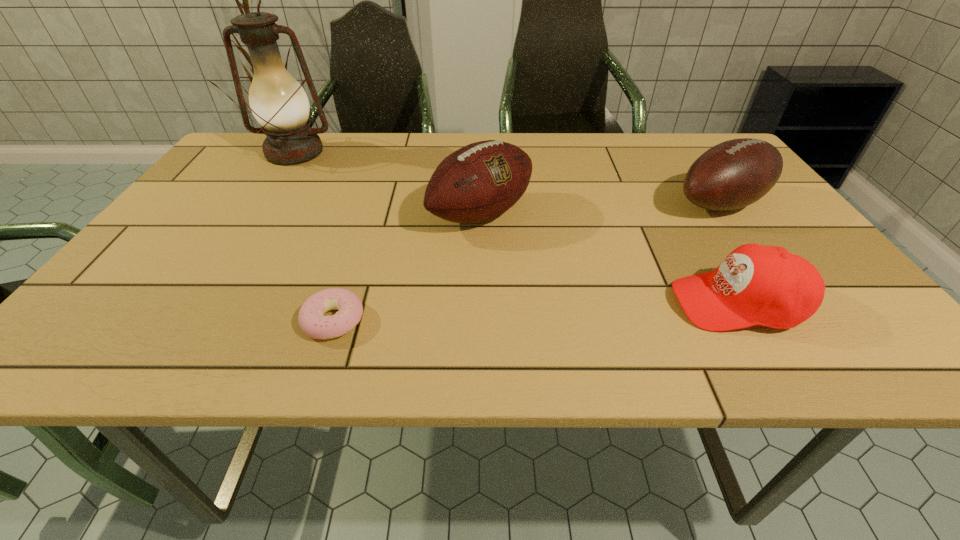
The image size is (960, 540). I want to click on object that is at the far left corner, so click(x=278, y=102).

Identify the location of object at the near right corner. The height and width of the screenshot is (540, 960). (762, 285).

Where is `free space at the far edge of the desktop`? free space at the far edge of the desktop is located at coordinates (346, 171).

Where is `free region at the left edge`? free region at the left edge is located at coordinates (203, 212).

Where is `free space at the right edge of the desktop`? This screenshot has height=540, width=960. free space at the right edge of the desktop is located at coordinates (831, 279).

In the image, there is a desktop. Find the location of `vacant space at the far right corner`. vacant space at the far right corner is located at coordinates (720, 139).

This screenshot has height=540, width=960. I want to click on vacant area that lies between the second object from left to right and the right football (American), so click(x=527, y=262).

Where is `free point between the shortest object and the farthest object`? free point between the shortest object and the farthest object is located at coordinates (314, 237).

At what (x,y) coordinates should I click in order to perform the action: click on free point between the leftmost object and the shortest object. Please return your answer as a coordinate pair (x, y). The height and width of the screenshot is (540, 960). Looking at the image, I should click on (314, 237).

Locate an element on the screen. This screenshot has width=960, height=540. free space between the left football (American) and the farthest object is located at coordinates point(388,183).